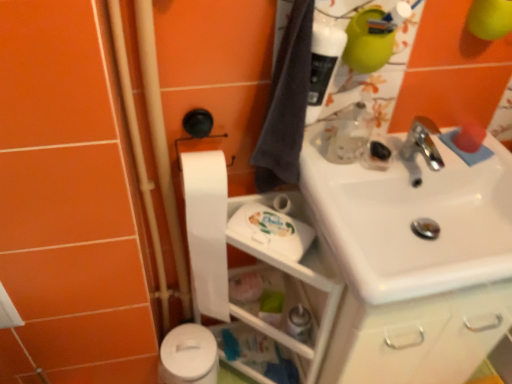
Question: Considering the relative sizes of white plastic shelf at lower center and translucent plastic spray bottle at lower center in the image provided, is white plastic shelf at lower center taller than translucent plastic spray bottle at lower center?

Choices:
 (A) no
 (B) yes

Answer: (B)

Question: Is white plastic shelf at lower center bigger than translucent plastic spray bottle at lower center?

Choices:
 (A) no
 (B) yes

Answer: (B)

Question: Is white plastic shelf at lower center oriented away from translucent plastic spray bottle at lower center?

Choices:
 (A) yes
 (B) no

Answer: (A)

Question: Is white plastic shelf at lower center positioned far away from translucent plastic spray bottle at lower center?

Choices:
 (A) no
 (B) yes

Answer: (A)

Question: Considering the relative positions of white plastic shelf at lower center and translucent plastic spray bottle at lower center in the image provided, is white plastic shelf at lower center to the right of translucent plastic spray bottle at lower center from the viewer's perspective?

Choices:
 (A) yes
 (B) no

Answer: (B)

Question: From the image's perspective, is white plastic shelf at lower center above translucent plastic spray bottle at lower center?

Choices:
 (A) yes
 (B) no

Answer: (B)

Question: Is white plastic shelf at lower center oriented towards white matte toilet paper at center-left, which is the 2th toilet paper from bottom to top?

Choices:
 (A) no
 (B) yes

Answer: (A)

Question: Is white plastic shelf at lower center outside of white matte toilet paper at center-left, which is the first toilet paper from top to bottom?

Choices:
 (A) yes
 (B) no

Answer: (A)

Question: From a real-world perspective, is white plastic shelf at lower center on top of white matte toilet paper at center-left, which is the 2th toilet paper from bottom to top?

Choices:
 (A) no
 (B) yes

Answer: (A)

Question: Does white plastic shelf at lower center have a lesser height compared to white matte toilet paper at center-left, which is the first toilet paper from top to bottom?

Choices:
 (A) yes
 (B) no

Answer: (B)

Question: Is white plastic shelf at lower center next to white matte toilet paper at center-left, which is the 2th toilet paper from bottom to top?

Choices:
 (A) yes
 (B) no

Answer: (A)

Question: From a real-world perspective, is white plastic shelf at lower center beneath white matte toilet paper at center-left, which is the first toilet paper from top to bottom?

Choices:
 (A) no
 (B) yes

Answer: (B)

Question: From a real-world perspective, is translucent plastic bottle at upper right positioned over white matte toilet paper at center-left, which is the 2th toilet paper from bottom to top, based on gravity?

Choices:
 (A) yes
 (B) no

Answer: (A)